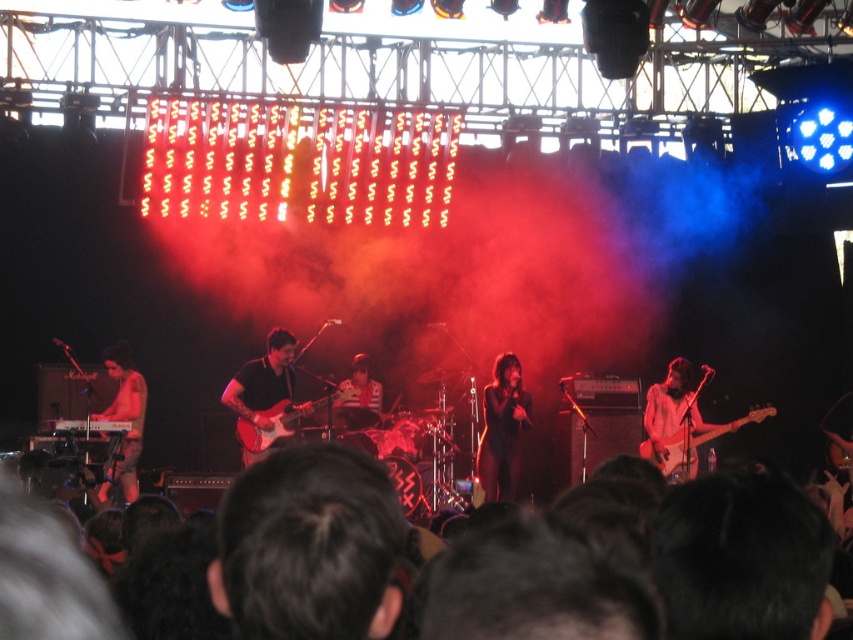
Question: Is black matte dress at center further to the viewer compared to striped fabric drum set at center?

Choices:
 (A) no
 (B) yes

Answer: (B)

Question: Which point is closer to the camera?

Choices:
 (A) shiny metallic keyboard at lower left
 (B) striped fabric drum set at center

Answer: (B)

Question: Which point is closer to the camera?

Choices:
 (A) (503, 444)
 (B) (131, 442)

Answer: (B)

Question: Where is shiny metallic keyboard at lower left located in relation to glossy wood guitar at center in the image?

Choices:
 (A) right
 (B) left

Answer: (B)

Question: Which object appears closest to the camera in this image?

Choices:
 (A) matte pink electric guitar at right
 (B) glossy wood guitar at center
 (C) matte black guitar at center
 (D) shiny metallic keyboard at lower left

Answer: (C)

Question: Is black matte dress at center below striped fabric drum set at center?

Choices:
 (A) no
 (B) yes

Answer: (B)